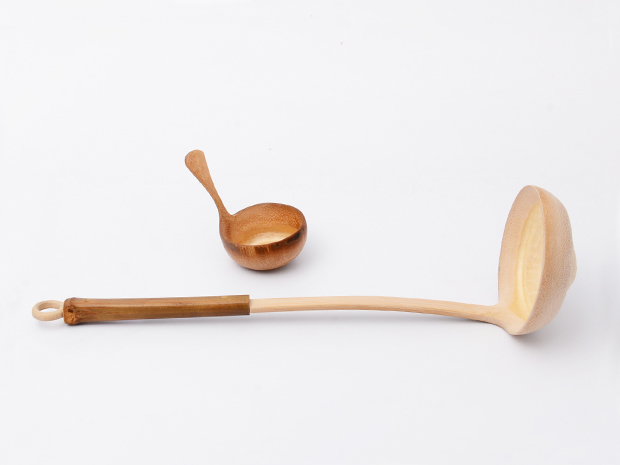
Where is `small handle`? small handle is located at coordinates (197, 166).